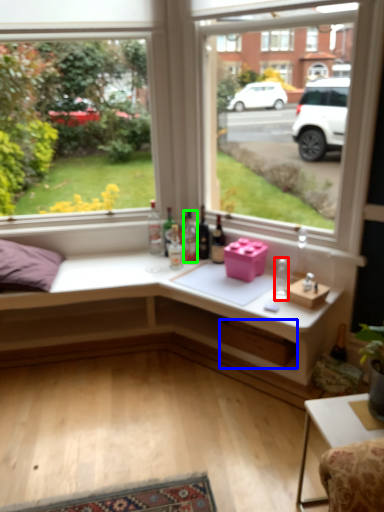
Question: Which object is positioned farthest from bottle (highlighted by a red box)? Select from window box (highlighted by a blue box) and bottle (highlighted by a green box).

Choices:
 (A) window box
 (B) bottle

Answer: (B)